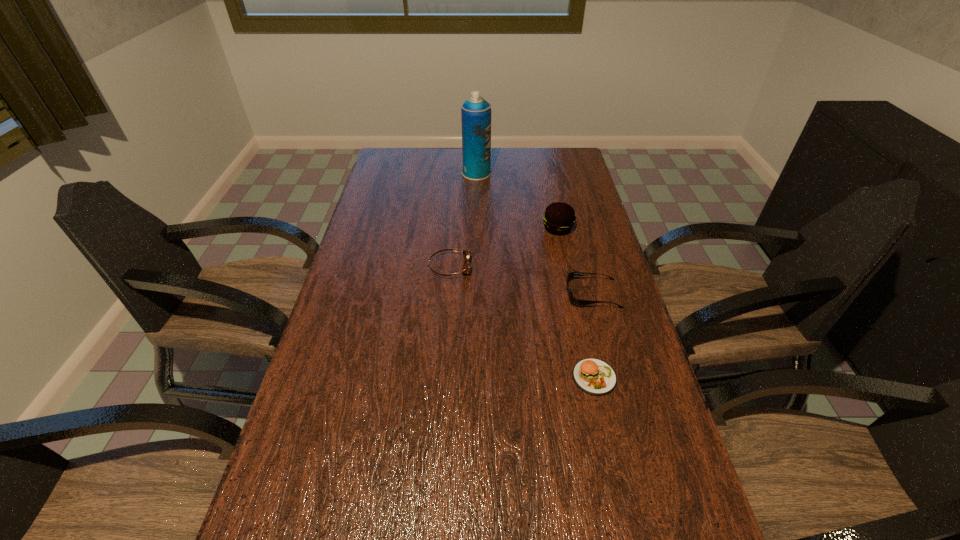
The height and width of the screenshot is (540, 960). In order to click on free space that is in between the goggles and the farthest object in this screenshot , I will do `click(463, 220)`.

Locate an element on the screen. free space that is in between the farther patty and the sunglasses is located at coordinates (575, 261).

Find the location of a particular element. free space between the farthest object and the goggles is located at coordinates (463, 220).

The height and width of the screenshot is (540, 960). Find the location of `free area in between the goggles and the sunglasses`. free area in between the goggles and the sunglasses is located at coordinates (521, 280).

This screenshot has width=960, height=540. In order to click on free space between the sunglasses and the fourth shortest object in this screenshot , I will do `click(575, 261)`.

Where is `vacant area between the goggles and the tallest object`? vacant area between the goggles and the tallest object is located at coordinates (463, 220).

Locate an element on the screen. This screenshot has height=540, width=960. vacant area that lies between the shorter patty and the aerosol can is located at coordinates (536, 275).

The image size is (960, 540). Find the location of `vacant area that lies between the farthest object and the shorter patty`. vacant area that lies between the farthest object and the shorter patty is located at coordinates (536, 275).

Identify the location of the third closest object relative to the nearest object. (559, 218).

The height and width of the screenshot is (540, 960). Identify the location of object that is the closest to the goggles. (559, 218).